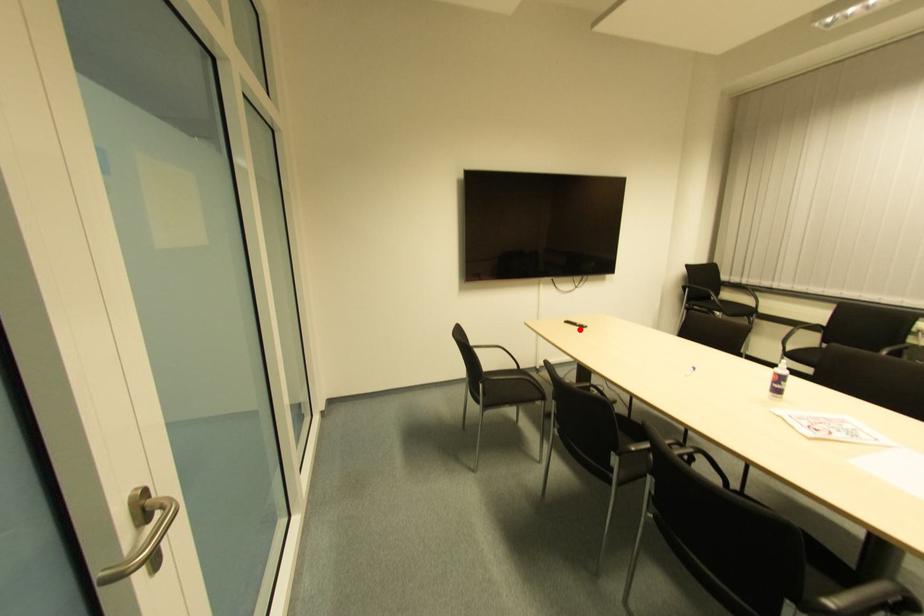
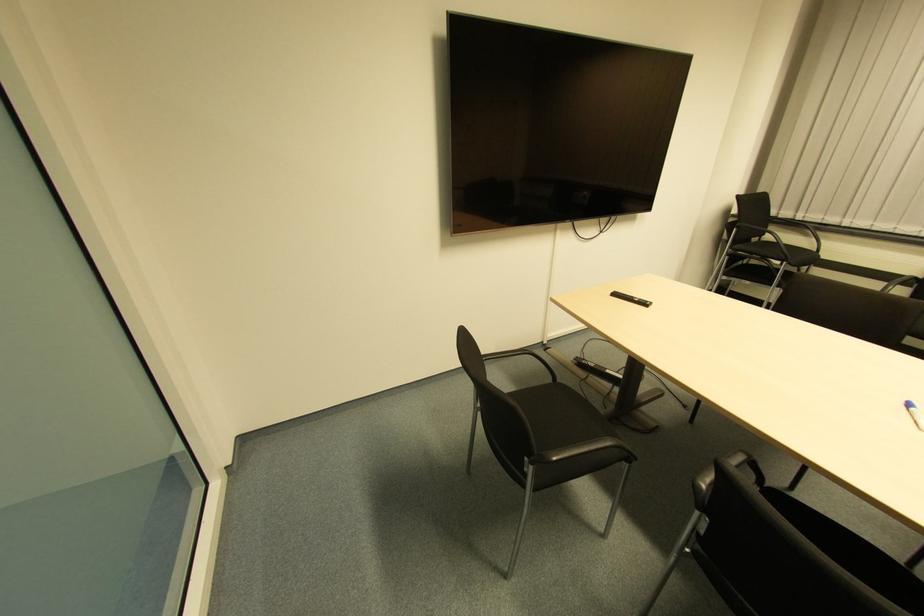
Locate, in the second image, the point that corresponds to the highlighted location in the first image.

(641, 306)